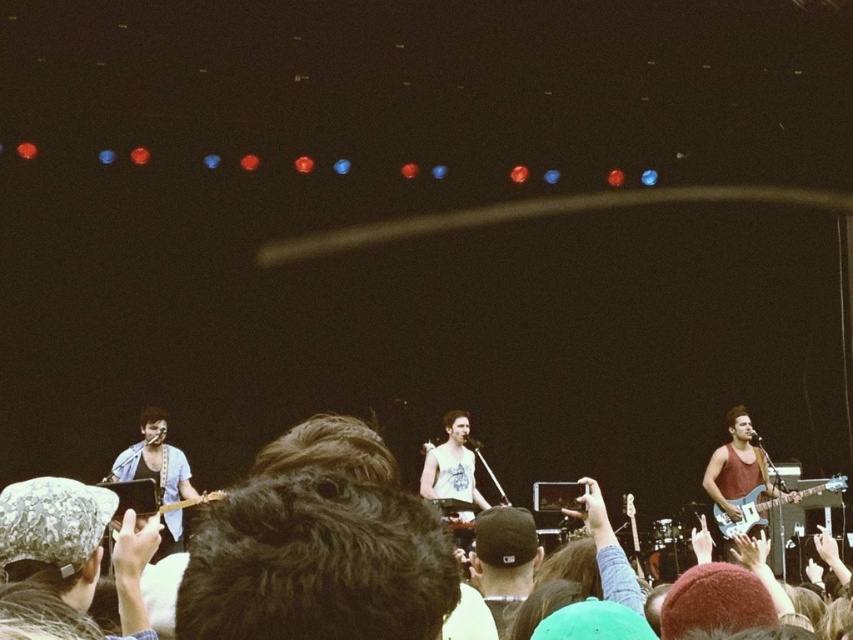
Which is behind, point (511, 596) or point (187, 499)?

Point (187, 499)

Who is higher up, black fabric cap at center or wooden acoustic guitar at lower left?

Positioned higher is black fabric cap at center.

The image size is (853, 640). I want to click on black fabric cap at center, so click(503, 557).

Is matte electric guitar at right below wooden acoustic guitar at lower left?

Correct, matte electric guitar at right is located below wooden acoustic guitar at lower left.

What do you see at coordinates (766, 506) in the screenshot?
I see `matte electric guitar at right` at bounding box center [766, 506].

This screenshot has height=640, width=853. What do you see at coordinates (766, 506) in the screenshot?
I see `matte electric guitar at right` at bounding box center [766, 506].

The height and width of the screenshot is (640, 853). Find the location of `matte electric guitar at right`. matte electric guitar at right is located at coordinates (766, 506).

Is point (480, 538) behind point (799, 493)?

No.

Can you confirm if black fabric cap at center is positioned below matte electric guitar at right?

Incorrect, black fabric cap at center is not positioned below matte electric guitar at right.

This screenshot has height=640, width=853. What do you see at coordinates (503, 557) in the screenshot?
I see `black fabric cap at center` at bounding box center [503, 557].

Identify the location of black fabric cap at center. (503, 557).